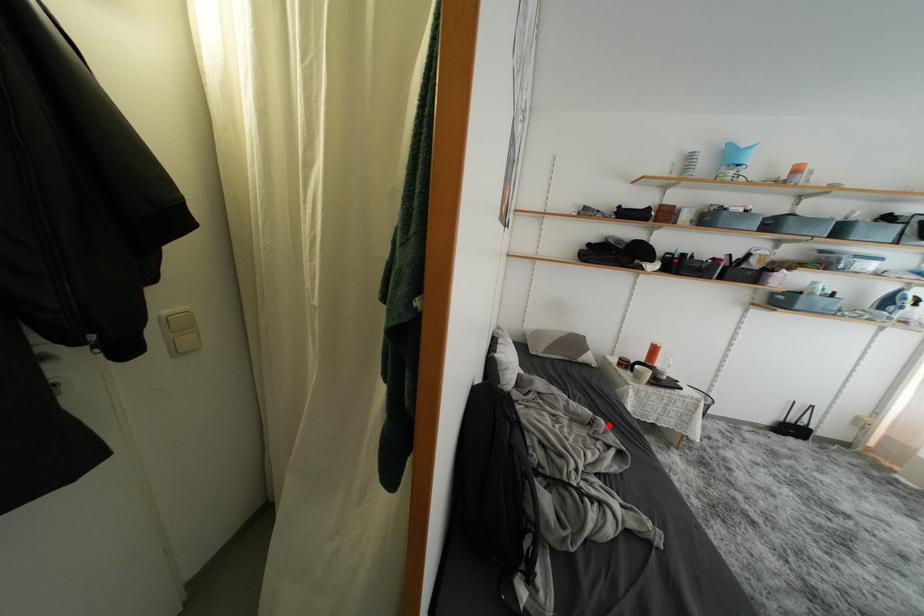
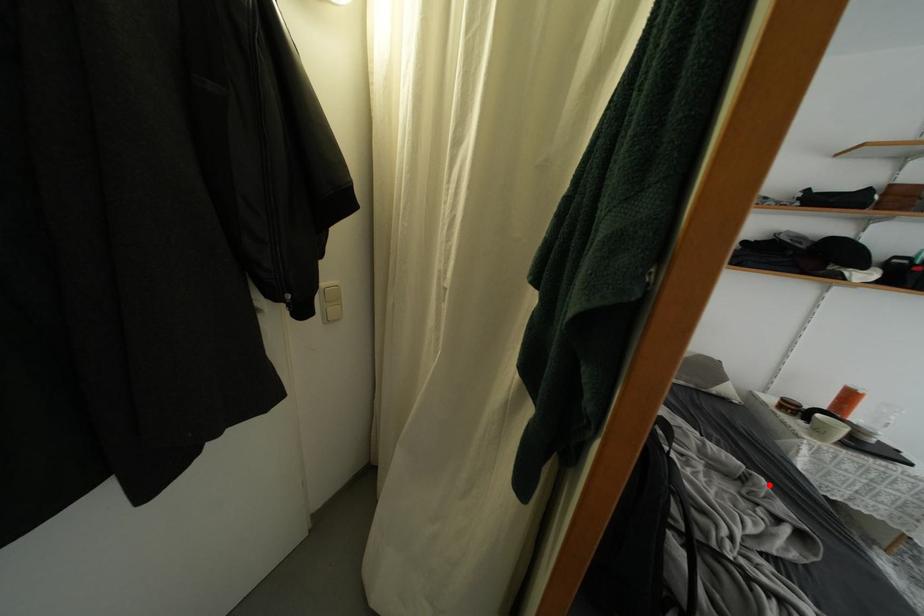
I am providing you with two images of the same scene from different viewpoints. A red point is marked on the first image and another point is marked on the second image. Does the point marked in image1 correspond to the same location as the one in image2?

Yes